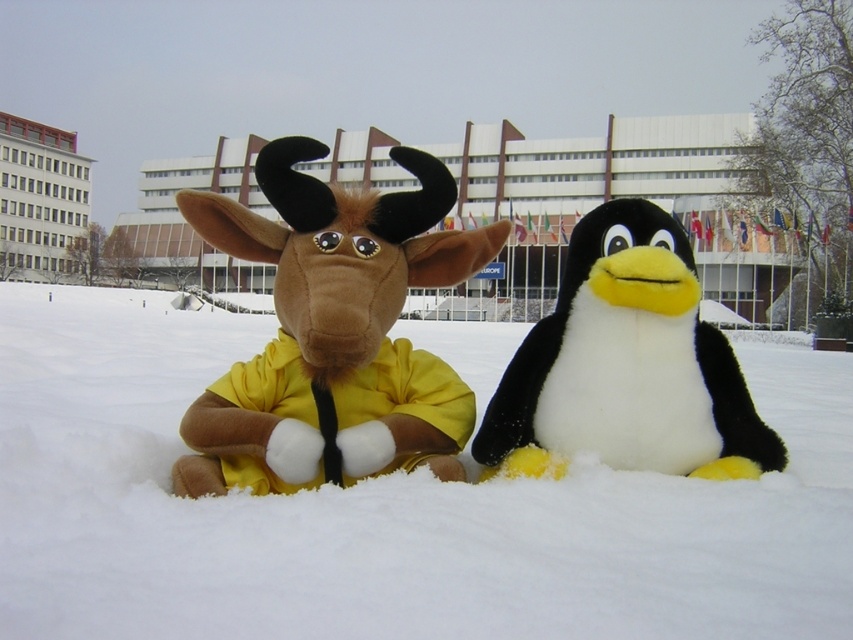
You are a photographer setting up a shot of the white fluffy snow at center and the fuzzy brown plush at center. You want to position your camera so that the snow is on the left side of the photo. Is the current arrangement already set up that way?

Yes, the white fluffy snow at center is already positioned to the left of the fuzzy brown plush at center, so the current arrangement meets your requirement.

You are trying to decide where to place a small gift box between the white fluffy snow at center and the black plush penguin at center. Based on their sizes, which location has more space for the gift box?

The white fluffy snow at center has a larger width than the black plush penguin at center, so placing the gift box there would provide more space.